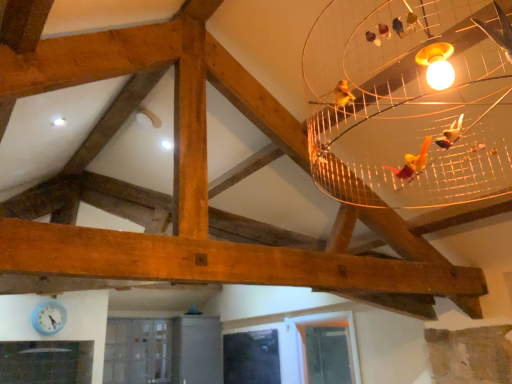
What is the approximate height of clear glass window at lower center, marked as the 1th window in a right-to-left arrangement?

It is 29.17 inches.

In order to face clear glass window at lower center, the first window when ordered from front to back, should I rotate leftwards or rightwards?

Turn right approximately 8.939 degrees to face it.

This screenshot has height=384, width=512. What do you see at coordinates (251, 357) in the screenshot?
I see `transparent glass window at lower center, which is the 1th window from left to right` at bounding box center [251, 357].

The height and width of the screenshot is (384, 512). What do you see at coordinates (49, 318) in the screenshot? I see `light blue plastic clock at lower left` at bounding box center [49, 318].

Where is `clear glass window at lower center, the first window when ordered from front to back`? The image size is (512, 384). clear glass window at lower center, the first window when ordered from front to back is located at coordinates (323, 326).

From the picture: Between clear glass window at lower center, which is counted as the 2th window, starting from the left, and transparent glass window at lower center, which appears as the first window when viewed from the back, which one appears on the left side from the viewer's perspective?

From the viewer's perspective, transparent glass window at lower center, which appears as the first window when viewed from the back, appears more on the left side.

Considering the sizes of clear glass window at lower center, which is counted as the 2th window, starting from the left, and transparent glass window at lower center, which appears as the 2th window when viewed from the right, in the image, is clear glass window at lower center, which is counted as the 2th window, starting from the left, bigger or smaller than transparent glass window at lower center, which appears as the 2th window when viewed from the right,?

Considering their sizes, clear glass window at lower center, which is counted as the 2th window, starting from the left, takes up more space than transparent glass window at lower center, which appears as the 2th window when viewed from the right.

Who is more distant, clear glass window at lower center, the first window when ordered from front to back, or transparent glass window at lower center, which is the 1th window from left to right?

transparent glass window at lower center, which is the 1th window from left to right, is further from the camera.

In terms of width, does clear glass window at lower center, the first window when ordered from front to back, look wider or thinner when compared to transparent glass window at lower center, placed as the 2th window when sorted from front to back?

Considering their sizes, clear glass window at lower center, the first window when ordered from front to back, looks broader than transparent glass window at lower center, placed as the 2th window when sorted from front to back.

Can we say light blue plastic clock at lower left lies outside transparent glass window at lower center, which is the 1th window from left to right?

Absolutely, light blue plastic clock at lower left is external to transparent glass window at lower center, which is the 1th window from left to right.

Consider the image. Considering the sizes of objects light blue plastic clock at lower left and transparent glass window at lower center, placed as the 2th window when sorted from front to back, in the image provided, who is wider, light blue plastic clock at lower left or transparent glass window at lower center, placed as the 2th window when sorted from front to back,?

With larger width is light blue plastic clock at lower left.

From the image's perspective, is light blue plastic clock at lower left on top of transparent glass window at lower center, which is the 1th window from left to right?

Yes, from the image's perspective, light blue plastic clock at lower left is over transparent glass window at lower center, which is the 1th window from left to right.

Which is behind, point (227, 373) or point (61, 316)?

The point (227, 373) is behind.

Between transparent glass window at lower center, which appears as the first window when viewed from the back, and light blue plastic clock at lower left, which one has less height?

Standing shorter between the two is light blue plastic clock at lower left.

Is transparent glass window at lower center, which is the 1th window from left to right, positioned in front of light blue plastic clock at lower left?

No, transparent glass window at lower center, which is the 1th window from left to right, is further to the viewer.

From a real-world perspective, between transparent glass window at lower center, which is the 1th window from left to right, and light blue plastic clock at lower left, who is vertically higher?

light blue plastic clock at lower left.

In terms of width, does light blue plastic clock at lower left look wider or thinner when compared to clear glass window at lower center, which is counted as the 2th window, starting from the left?

Considering their sizes, light blue plastic clock at lower left looks slimmer than clear glass window at lower center, which is counted as the 2th window, starting from the left.

Is light blue plastic clock at lower left looking in the opposite direction of clear glass window at lower center, which is counted as the 2th window, starting from the left?

No, light blue plastic clock at lower left is not facing the opposite direction of clear glass window at lower center, which is counted as the 2th window, starting from the left.

Is point (57, 321) closer or farther from the camera than point (293, 341)?

Clearly, point (57, 321) is closer to the camera than point (293, 341).

Is clear glass window at lower center, which is counted as the 2th window, starting from the left, at the back of transparent glass window at lower center, which appears as the first window when viewed from the back?

No, transparent glass window at lower center, which appears as the first window when viewed from the back,'s orientation is not away from clear glass window at lower center, which is counted as the 2th window, starting from the left.

Between transparent glass window at lower center, placed as the 2th window when sorted from front to back, and clear glass window at lower center, the first window when ordered from front to back, which one has less height?

Standing shorter between the two is transparent glass window at lower center, placed as the 2th window when sorted from front to back.

Would you say transparent glass window at lower center, which appears as the 2th window when viewed from the right, is a long distance from clear glass window at lower center, which is counted as the 2th window, starting from the left?

Actually, transparent glass window at lower center, which appears as the 2th window when viewed from the right, and clear glass window at lower center, which is counted as the 2th window, starting from the left, are a little close together.

Which is more to the left, transparent glass window at lower center, which appears as the first window when viewed from the back, or clear glass window at lower center, which is counted as the 2th window, starting from the left?

From the viewer's perspective, transparent glass window at lower center, which appears as the first window when viewed from the back, appears more on the left side.

Considering the relative sizes of clear glass window at lower center, marked as the 1th window in a right-to-left arrangement, and light blue plastic clock at lower left in the image provided, is clear glass window at lower center, marked as the 1th window in a right-to-left arrangement, taller than light blue plastic clock at lower left?

Yes, clear glass window at lower center, marked as the 1th window in a right-to-left arrangement, is taller than light blue plastic clock at lower left.

At what (x,y) coordinates should I click in order to perform the action: click on clock located behind the clear glass window at lower center, marked as the 1th window in a right-to-left arrangement. Please return your answer as a coordinate pair (x, y). Looking at the image, I should click on (49, 318).

Which object is further away from the camera taking this photo, clear glass window at lower center, marked as the 1th window in a right-to-left arrangement, or light blue plastic clock at lower left?

light blue plastic clock at lower left is further away from the camera.

Is clear glass window at lower center, which is counted as the 2th window, starting from the left, looking in the opposite direction of light blue plastic clock at lower left?

clear glass window at lower center, which is counted as the 2th window, starting from the left, does not have its back to light blue plastic clock at lower left.

Image resolution: width=512 pixels, height=384 pixels. I want to click on window positioned vertically above the transparent glass window at lower center, which appears as the 2th window when viewed from the right (from a real-world perspective), so 323,326.

The width and height of the screenshot is (512, 384). Identify the location of window that is the 1st object to the right of the light blue plastic clock at lower left, starting at the anchor. (251, 357).

Which object lies nearer to the anchor point light blue plastic clock at lower left, clear glass window at lower center, arranged as the second window when viewed from the back, or transparent glass window at lower center, placed as the 2th window when sorted from front to back?

Based on the image, transparent glass window at lower center, placed as the 2th window when sorted from front to back, appears to be nearer to light blue plastic clock at lower left.

Which object lies nearer to the anchor point clear glass window at lower center, the first window when ordered from front to back, transparent glass window at lower center, which is the 1th window from left to right, or light blue plastic clock at lower left?

transparent glass window at lower center, which is the 1th window from left to right.

From the image, which object appears to be farther from transparent glass window at lower center, which appears as the first window when viewed from the back, light blue plastic clock at lower left or clear glass window at lower center, arranged as the second window when viewed from the back?

Among the two, light blue plastic clock at lower left is located further to transparent glass window at lower center, which appears as the first window when viewed from the back.

When comparing their distances from transparent glass window at lower center, which is the 1th window from left to right, does clear glass window at lower center, which is counted as the 2th window, starting from the left, or light blue plastic clock at lower left seem closer?

clear glass window at lower center, which is counted as the 2th window, starting from the left.

When comparing their distances from light blue plastic clock at lower left, does transparent glass window at lower center, placed as the 2th window when sorted from front to back, or clear glass window at lower center, the first window when ordered from front to back, seem further?

The object further to light blue plastic clock at lower left is clear glass window at lower center, the first window when ordered from front to back.

Based on their spatial positions, is light blue plastic clock at lower left or transparent glass window at lower center, placed as the 2th window when sorted from front to back, closer to clear glass window at lower center, marked as the 1th window in a right-to-left arrangement?

Based on the image, transparent glass window at lower center, placed as the 2th window when sorted from front to back, appears to be nearer to clear glass window at lower center, marked as the 1th window in a right-to-left arrangement.

Find the location of a particular element. window situated between light blue plastic clock at lower left and clear glass window at lower center, marked as the 1th window in a right-to-left arrangement, from left to right is located at coordinates (251, 357).